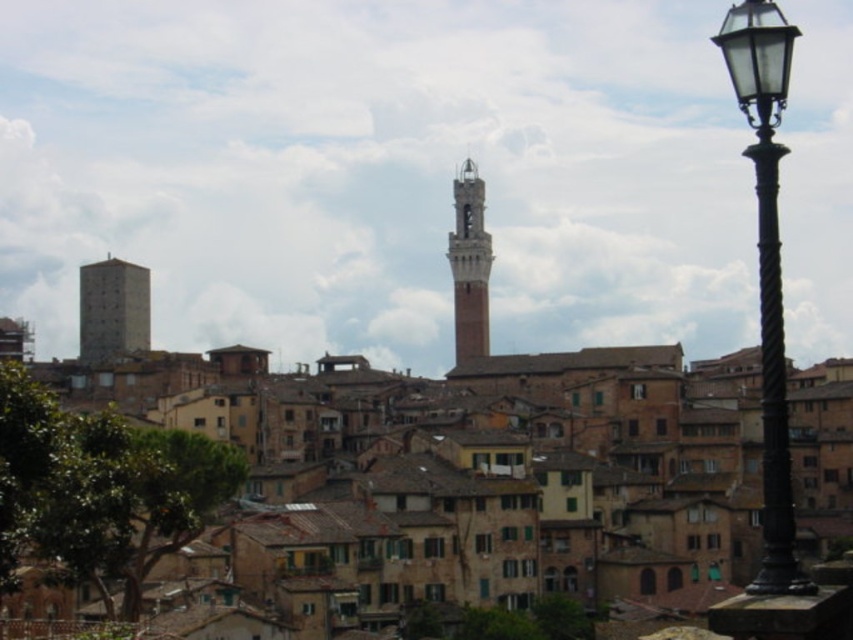
You are a tourist standing in the historic town square. You notice two towers in the distance. The gray stone tower at left and the brick tower at center. Which tower has a larger base width?

The gray stone tower at left might be wider than brick tower at center according to the description.

You are standing in the historic town and want to take a photo that includes both the black ornate streetlamp in the foreground and the tall slender tower in the midground. Which point, point (132,264) or point (485,241), is closer to the camera and should be focused on first to ensure both subjects are in focus?

Point (132,264) is closer to the camera than point (485,241), so you should focus on point (132,264) first to ensure both the black ornate streetlamp and the tall slender tower are in focus.